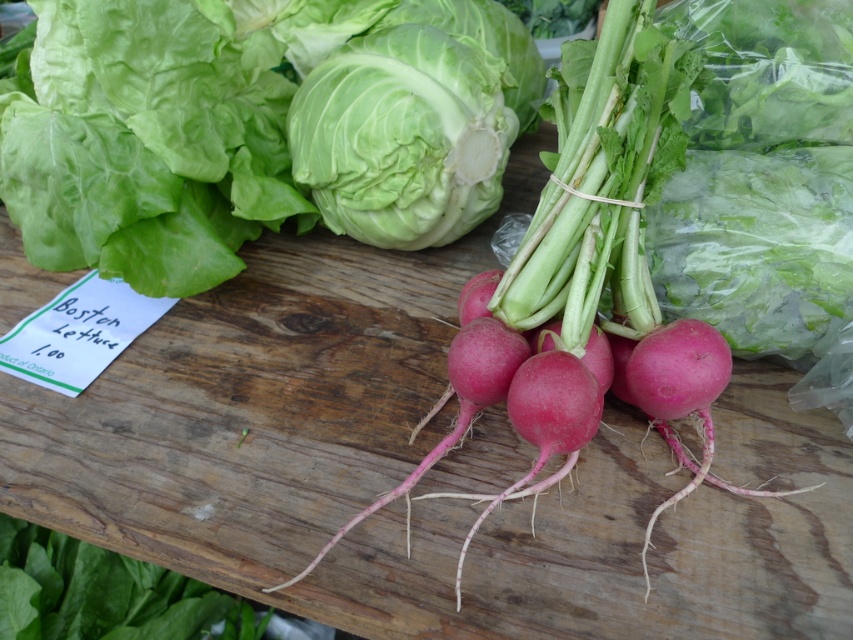
Question: Is smooth red radish at center below white crisp lettuce at center?

Choices:
 (A) no
 (B) yes

Answer: (B)

Question: Which object appears farthest from the camera in this image?

Choices:
 (A) smooth red radish at center
 (B) white crisp lettuce at center

Answer: (B)

Question: Can you confirm if smooth red radish at center is positioned below white crisp lettuce at center?

Choices:
 (A) yes
 (B) no

Answer: (A)

Question: Does smooth red radish at center have a greater width compared to white crisp lettuce at center?

Choices:
 (A) no
 (B) yes

Answer: (B)

Question: Which point appears closest to the camera in this image?

Choices:
 (A) (393, 492)
 (B) (514, 120)

Answer: (A)